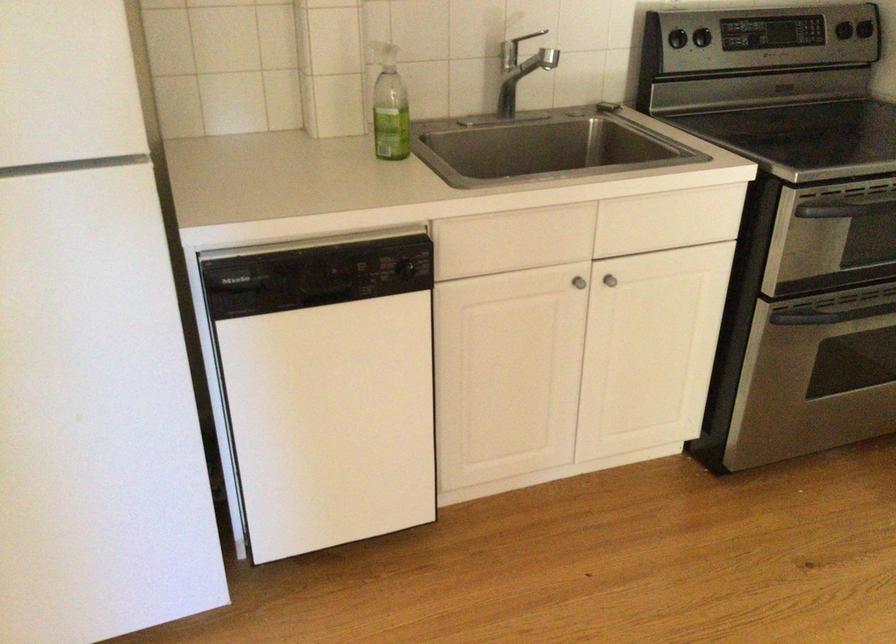
This screenshot has width=896, height=644. Find the location of `black dishwasher handle`. black dishwasher handle is located at coordinates (398, 267).